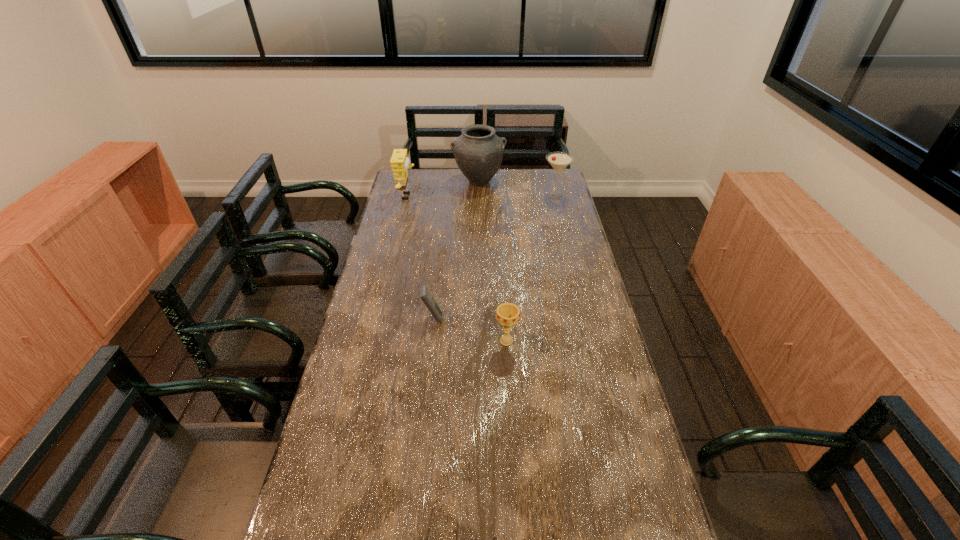
Identify the location of the tallest object. (478, 152).

You are a GUI agent. You are given a task and a screenshot of the screen. Output one action in this format:
    pyautogui.click(x=<x>, y=<y>)
    Task: Click on the leftmost object
    
    Given the screenshot: What is the action you would take?
    pyautogui.click(x=399, y=161)

The image size is (960, 540). I want to click on the rightmost object, so click(559, 161).

You are a GUI agent. You are given a task and a screenshot of the screen. Output one action in this format:
    pyautogui.click(x=<x>, y=<y>)
    Task: Click on the fifth farthest object
    The height and width of the screenshot is (540, 960).
    Given the screenshot: What is the action you would take?
    click(x=508, y=314)

Where is `the fourth farthest object`? the fourth farthest object is located at coordinates (425, 295).

I want to click on vacant space situated on the left of the urn, so click(x=409, y=181).

You are a GUI agent. You are given a task and a screenshot of the screen. Output one action in this format:
    pyautogui.click(x=<x>, y=<y>)
    Task: Click on the free location located 0.210m on the front-facing side of the sponge
    Image resolution: width=960 pixels, height=540 pixels.
    Given the screenshot: What is the action you would take?
    pyautogui.click(x=463, y=197)

Identify the location of free spot located 0.290m on the left of the martini. (480, 195).

Identify the location of free point located 0.150m on the back of the chalice. (504, 300).

Find the location of a particular element. The height and width of the screenshot is (540, 960). free space located on the front-facing side of the calculator is located at coordinates (564, 317).